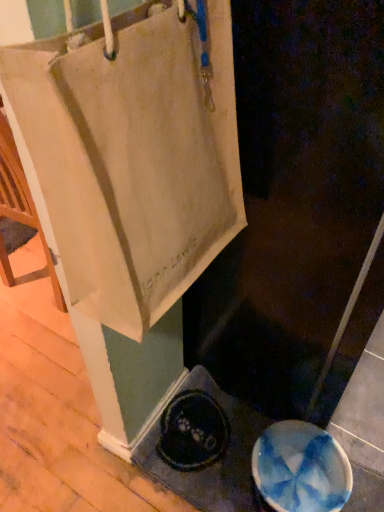
Question: In terms of size, does beige canvas tote at upper left appear bigger or smaller than blue glossy manhole cover at lower right?

Choices:
 (A) big
 (B) small

Answer: (A)

Question: Considering the relative positions of beige canvas tote at upper left and blue glossy manhole cover at lower right in the image provided, is beige canvas tote at upper left to the left or to the right of blue glossy manhole cover at lower right?

Choices:
 (A) left
 (B) right

Answer: (A)

Question: Considering the real-world distances, which object is farthest from the white canvas bag at upper left?

Choices:
 (A) blue glossy manhole cover at lower right
 (B) beige canvas tote at upper left

Answer: (A)

Question: Estimate the real-world distances between objects in this image. Which object is farther from the blue glossy manhole cover at lower right?

Choices:
 (A) white canvas bag at upper left
 (B) beige canvas tote at upper left

Answer: (B)